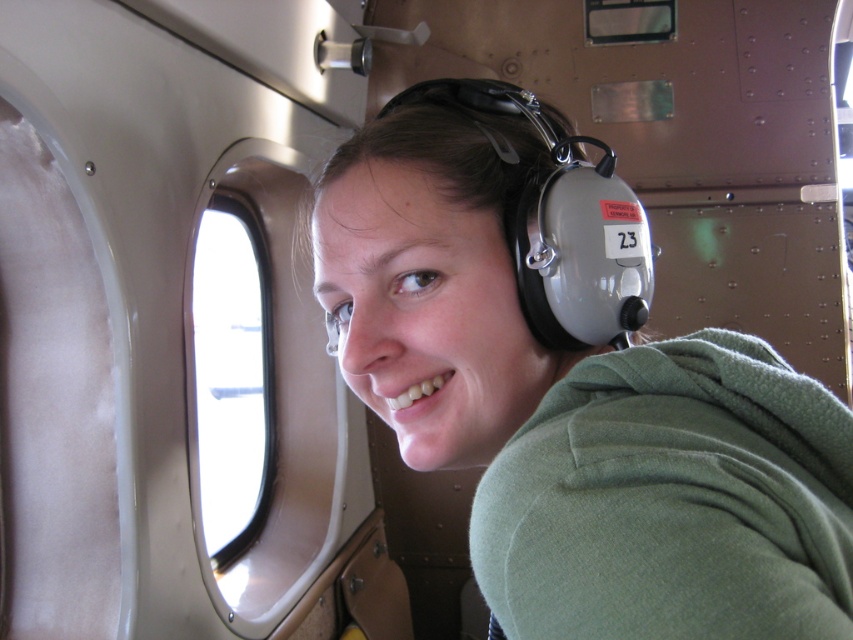
You are a flight attendant on a small aircraft and need to retrieve an item from the green fleece at center. Based on its coordinates, where exactly should you look?

The green fleece at center is located at point (573, 403), so you should look there to find it.

You are a passenger on an airplane and want to see the view outside through the transparent glass airplane window at upper left. However, your green fleece sweatshirt at center is blocking your view. Can you move the sweatshirt to the left to get a better view?

The green fleece sweatshirt at center is currently to the right of the transparent glass airplane window at upper left. Moving it to the left would place it closer to the window, which might still block your view. Alternatively, moving it to the right would provide a clearer view.